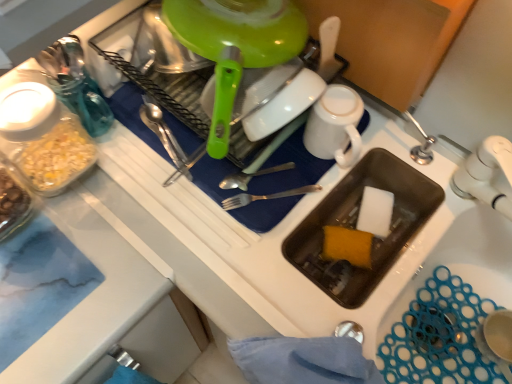
The width and height of the screenshot is (512, 384). I want to click on vacant space in front of silver metallic fork at center, so click(x=265, y=271).